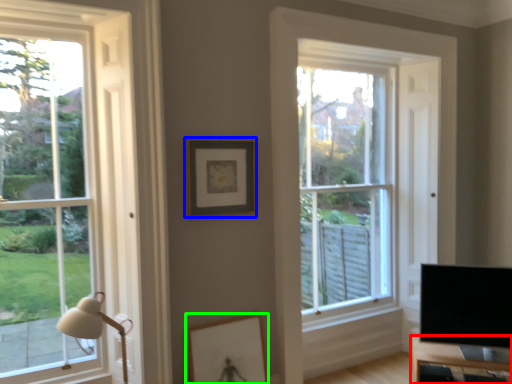
Question: Estimate the real-world distances between objects in this image. Which object is closer to table (highlighted by a red box), picture frame (highlighted by a blue box) or picture frame (highlighted by a green box)?

Choices:
 (A) picture frame
 (B) picture frame

Answer: (B)